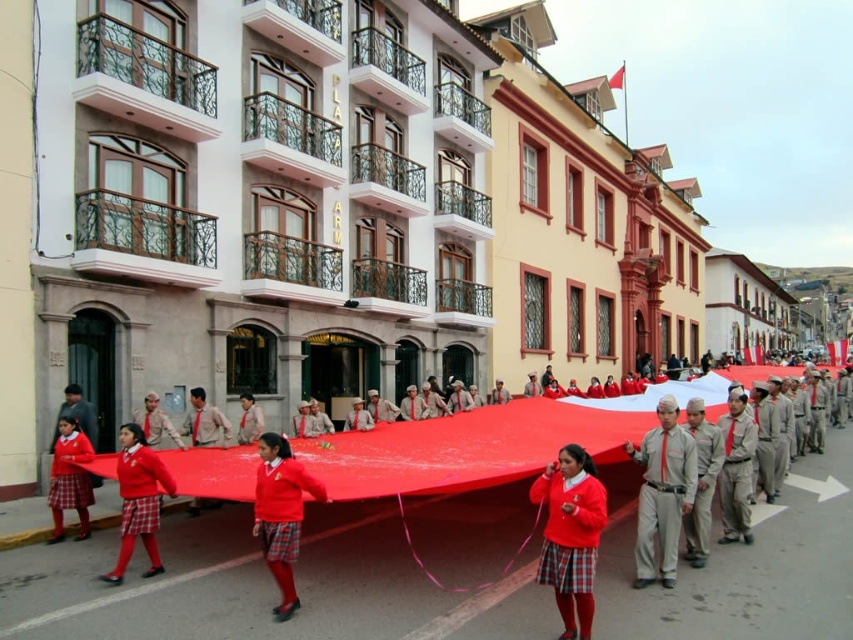
In the scene shown: Which of these two, red plaid skirt at lower left or khaki cotton uniform at center, stands taller?

Standing taller between the two is red plaid skirt at lower left.

Who is positioned more to the left, red plaid skirt at lower left or khaki cotton uniform at center?

red plaid skirt at lower left

Locate an element on the screen. The height and width of the screenshot is (640, 853). red plaid skirt at lower left is located at coordinates (68, 477).

Can you confirm if matte red uniform at center is wider than khaki cotton uniform at center?

Yes.

Does matte red uniform at center appear on the right side of khaki cotton uniform at center?

In fact, matte red uniform at center is to the left of khaki cotton uniform at center.

Which is in front, point (117, 456) or point (352, 404)?

Point (117, 456) is more forward.

Where is `matte red uniform at center`? The image size is (853, 640). matte red uniform at center is located at coordinates (138, 499).

Can you confirm if light gray cotton pants at center is positioned to the left of red plaid skirt at lower left?

Incorrect, light gray cotton pants at center is not on the left side of red plaid skirt at lower left.

Is light gray cotton pants at center in front of red plaid skirt at lower left?

Yes.

Locate an element on the screen. This screenshot has height=640, width=853. light gray cotton pants at center is located at coordinates (662, 497).

Find the location of a particular element. light gray cotton pants at center is located at coordinates (662, 497).